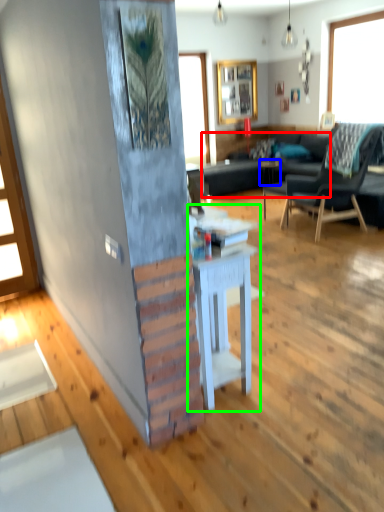
Question: Estimate the real-world distances between objects in this image. Which object is farther from studio couch (highlighted by a red box), side table (highlighted by a blue box) or table (highlighted by a green box)?

Choices:
 (A) side table
 (B) table

Answer: (B)